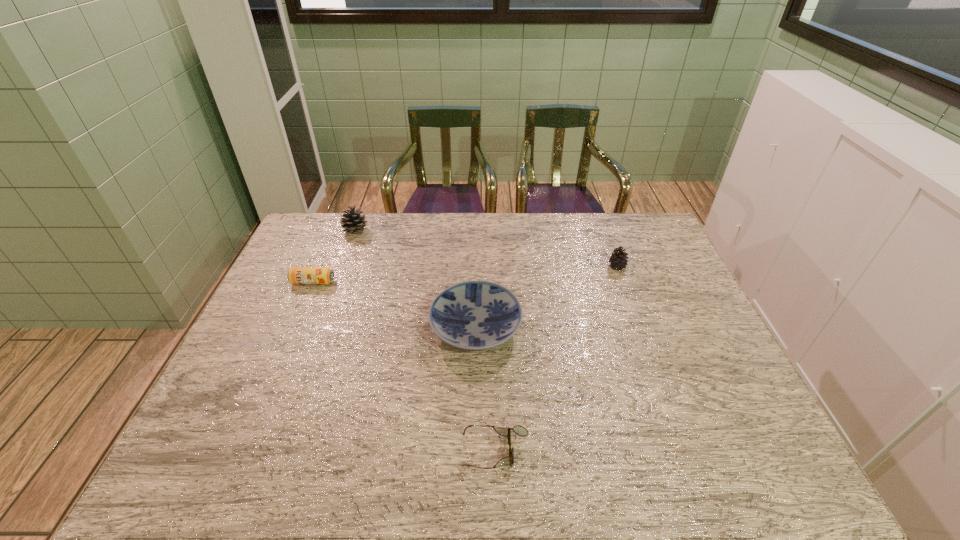
Locate an element on the screen. Image resolution: width=960 pixels, height=540 pixels. free region located on the left of the second farthest object is located at coordinates (568, 267).

The image size is (960, 540). In order to click on vacant space located on the front of the plate in this screenshot , I will do `click(475, 391)`.

Find the location of `free spot located on the front of the third nearest object`. free spot located on the front of the third nearest object is located at coordinates (x=282, y=353).

The width and height of the screenshot is (960, 540). Find the location of `vacant position located 0.080m on the front-facing side of the shortest object`. vacant position located 0.080m on the front-facing side of the shortest object is located at coordinates (425, 450).

Locate an element on the screen. The image size is (960, 540). vacant region located 0.320m on the front-facing side of the shortest object is located at coordinates (317, 450).

At what (x,y) coordinates should I click in order to perform the action: click on vacant space located 0.390m on the front-facing side of the shortest object. Please return your answer as a coordinate pair (x, y). Image resolution: width=960 pixels, height=540 pixels. Looking at the image, I should click on (285, 450).

This screenshot has height=540, width=960. I want to click on object present at the far edge, so click(x=352, y=222).

At what (x,y) coordinates should I click in order to perform the action: click on object that is positioned at the near edge. Please return your answer as a coordinate pair (x, y). The image size is (960, 540). Looking at the image, I should click on (519, 430).

The width and height of the screenshot is (960, 540). I want to click on pinecone that is at the left edge, so click(x=352, y=222).

I want to click on beer can present at the left edge, so click(296, 275).